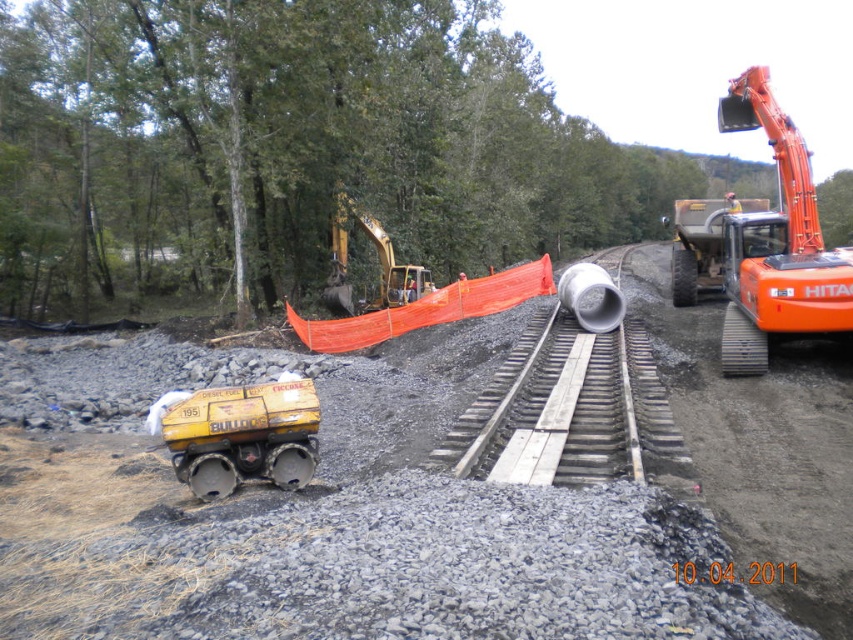
Question: Among these objects, which one is farthest from the camera?

Choices:
 (A) yellow matte fuel tank at lower left
 (B) yellow rubber excavator at center
 (C) orange metallic excavator at right
 (D) matte yellow bulldozer at lower left

Answer: (B)

Question: Which object is closer to the camera taking this photo?

Choices:
 (A) yellow rubber excavator at center
 (B) orange metallic excavator at right
 (C) matte yellow bulldozer at lower left
 (D) yellow matte fuel tank at lower left

Answer: (C)

Question: Which point is farther to the camera?

Choices:
 (A) (345, 272)
 (B) (271, 404)
 (C) (817, 321)
 (D) (511, 611)

Answer: (A)

Question: Can you confirm if matte yellow bulldozer at lower left is positioned above yellow rubber excavator at center?

Choices:
 (A) yes
 (B) no

Answer: (B)

Question: Can you confirm if orange metallic excavator at right is positioned below yellow rubber excavator at center?

Choices:
 (A) no
 (B) yes

Answer: (A)

Question: Is matte yellow bulldozer at lower left to the left of orange metallic excavator at right from the viewer's perspective?

Choices:
 (A) yes
 (B) no

Answer: (A)